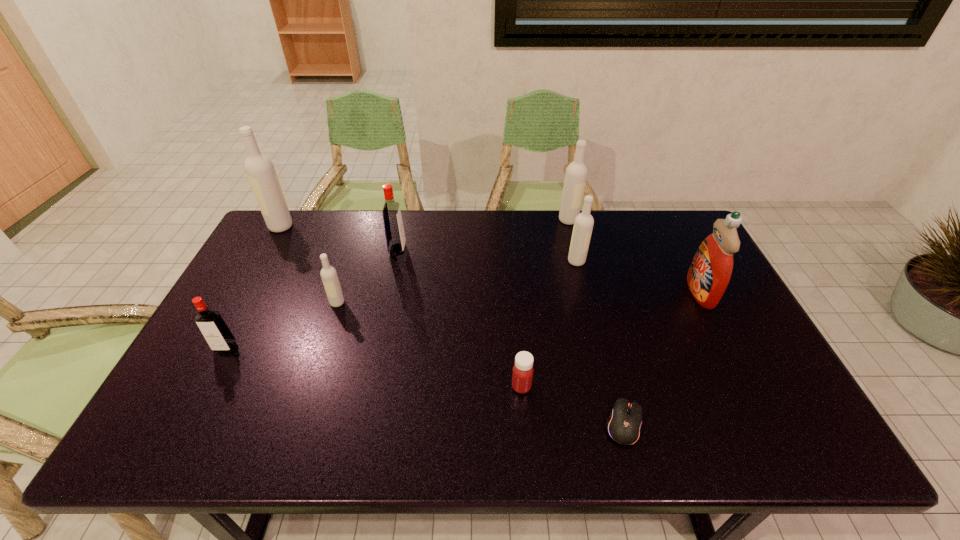
Locate an element on the screen. white vodka object that ranks as the fourth closest to the bigger red vodka is located at coordinates (576, 173).

Identify which white vodka is located as the third nearest to the rightmost object. Please provide its 2D coordinates. Your answer should be formatted as a tuple, i.e. [(x, y)], where the tuple contains the x and y coordinates of a point satisfying the conditions above.

[(330, 280)]

The height and width of the screenshot is (540, 960). I want to click on free space that satisfies the following two spatial constraints: 1. on the front surface of the rightmost object; 2. on the front and back of the third nearest object, so click(x=729, y=348).

This screenshot has width=960, height=540. What are the coordinates of `vacant area that satisfies the following two spatial constraints: 1. on the front and back of the shortest object; 2. on the right side of the nearest vodka` in the screenshot? It's located at click(185, 424).

Find the location of a particular element. Image resolution: width=960 pixels, height=540 pixels. free space that satisfies the following two spatial constraints: 1. on the front and back of the farther red vodka; 2. on the back side of the shortest object is located at coordinates (360, 424).

At what (x,y) coordinates should I click in order to perform the action: click on free space that satisfies the following two spatial constraints: 1. on the front and back of the farther red vodka; 2. on the right side of the shortest object. Please return your answer as a coordinate pair (x, y). This screenshot has height=540, width=960. Looking at the image, I should click on coord(360,424).